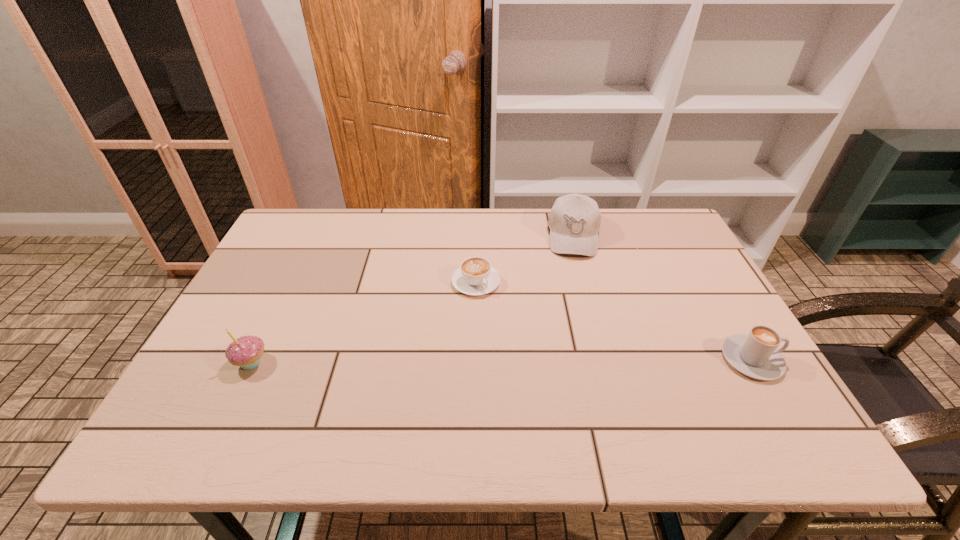
Find the location of a particular element. This screenshot has height=540, width=960. unoccupied position between the baseball cap and the leftmost object is located at coordinates (413, 299).

The image size is (960, 540). I want to click on vacant region between the shortest object and the baseball cap, so click(x=525, y=259).

This screenshot has width=960, height=540. In order to click on free spot between the shortest object and the cupcake in this screenshot , I will do (364, 322).

You are a GUI agent. You are given a task and a screenshot of the screen. Output one action in this format:
    pyautogui.click(x=<x>, y=<y>)
    Task: Click on the empty location between the right cappuccino and the shortest object
    
    Given the screenshot: What is the action you would take?
    pyautogui.click(x=613, y=321)

Find the location of a particular element. This screenshot has height=540, width=960. free area in between the farther cappuccino and the cupcake is located at coordinates (364, 322).

The image size is (960, 540). In order to click on free point between the leftmost object and the shorter cappuccino in this screenshot , I will do `click(364, 322)`.

Select which object is the closest to the farthest object. Please provide its 2D coordinates. Your answer should be formatted as a tuple, i.e. [(x, y)], where the tuple contains the x and y coordinates of a point satisfying the conditions above.

[(475, 276)]

Choose which object is the nearest neighbor to the cupcake. Please provide its 2D coordinates. Your answer should be formatted as a tuple, i.e. [(x, y)], where the tuple contains the x and y coordinates of a point satisfying the conditions above.

[(475, 276)]

The height and width of the screenshot is (540, 960). Identify the location of vacant space that satisfies the following two spatial constraints: 1. on the front side of the shorter cappuccino; 2. to the right of the nearer cappuccino. 475,359.

The width and height of the screenshot is (960, 540). Identify the location of blank space that satisfies the following two spatial constraints: 1. on the back side of the right cappuccino; 2. to the right of the leftmost object. (252, 359).